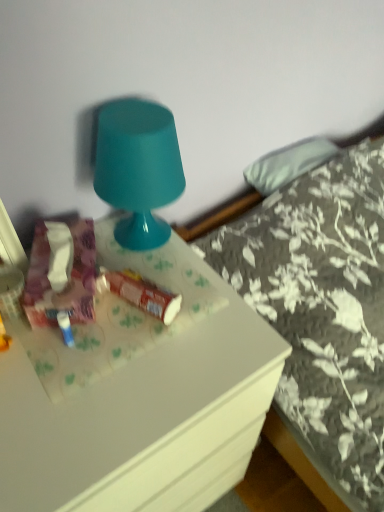
Identify the location of unoccupied space behind matte plastic tube at center, the second stuff when ordered from left to right. This screenshot has width=384, height=512. (148, 256).